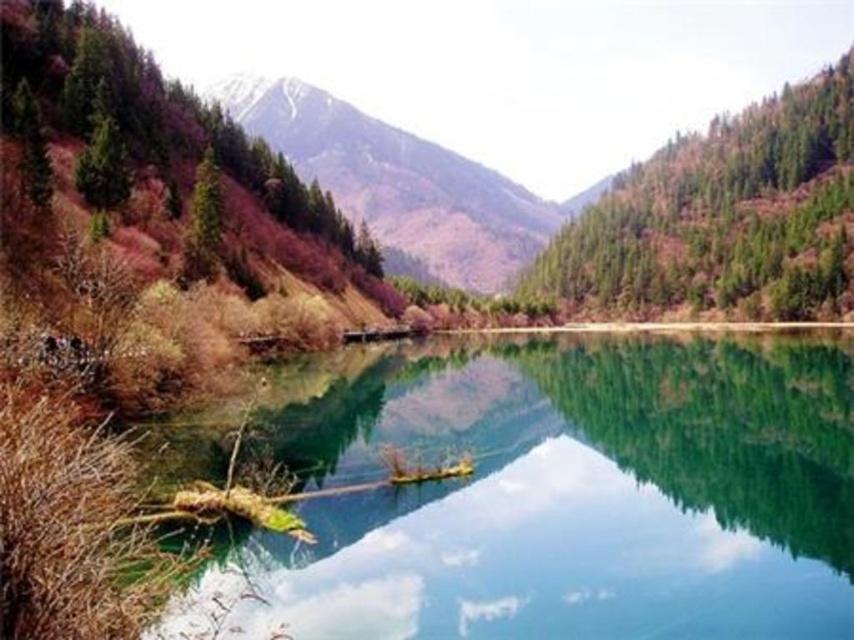
You are an artist planning to paint the landscape. You need to decide which area to focus on first based on their sizes. Which object should you paint first, the green smooth water at center or the green forested mountain at upper center?

The green smooth water at center is thinner than the green forested mountain at upper center, so you should paint the green forested mountain at upper center first as it is larger and might form the background structure.

You are standing at the edge of the lake and see the point marked at coordinates (562,497). What is located at that point?

The point at coordinates (562,497) indicates green smooth water at center.